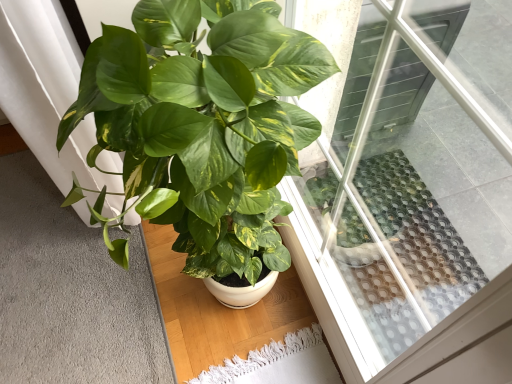
Where is `free space underneath soft gray carpet at lower left (from a real-world perspective)`? free space underneath soft gray carpet at lower left (from a real-world perspective) is located at coordinates (73, 290).